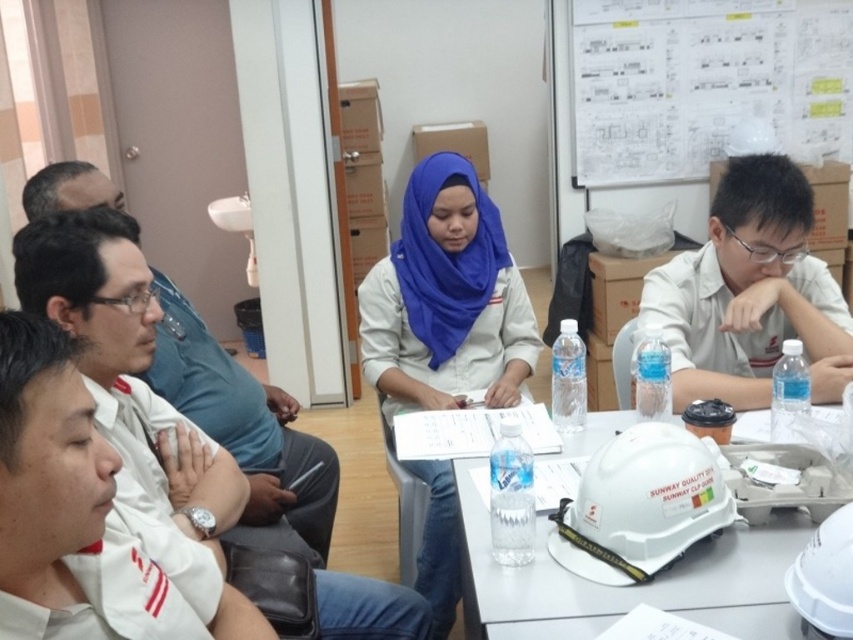
Question: Which object is farther from the camera taking this photo?

Choices:
 (A) matte blue hijab at center
 (B) white hard hat at center

Answer: (A)

Question: Can you confirm if matte blue hijab at center is positioned to the left of white hard hat at center?

Choices:
 (A) no
 (B) yes

Answer: (B)

Question: Which object appears closest to the camera in this image?

Choices:
 (A) white hard hat at center
 (B) matte blue hijab at center

Answer: (A)

Question: Can you confirm if matte blue hijab at center is positioned below white hard hat at center?

Choices:
 (A) yes
 (B) no

Answer: (B)

Question: Observing the image, what is the correct spatial positioning of matte blue hijab at center in reference to white hard hat at center?

Choices:
 (A) below
 (B) above

Answer: (B)

Question: Which of the following is the farthest from the observer?

Choices:
 (A) white hard hat at center
 (B) matte blue hijab at center

Answer: (B)